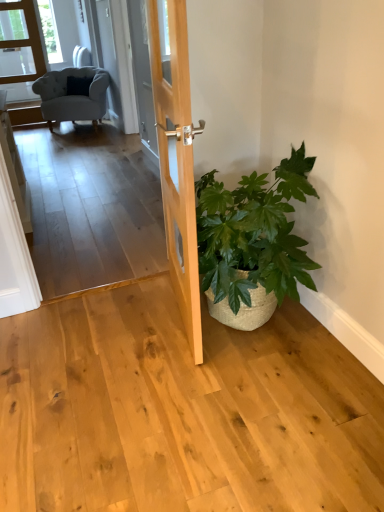
At what (x,y) coordinates should I click in order to perform the action: click on free spot in front of light brown wood door at center. Please return your answer as a coordinate pair (x, y). This screenshot has width=384, height=512. Looking at the image, I should click on (170, 389).